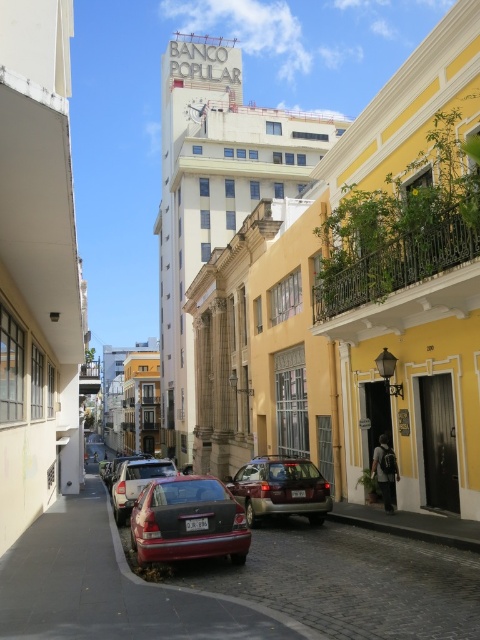
Question: Can you confirm if shiny red sedan at lower center is positioned below matte gray suv at center?

Choices:
 (A) no
 (B) yes

Answer: (A)

Question: Which of the following is the closest to the observer?

Choices:
 (A) (127, 483)
 (B) (295, 493)

Answer: (B)

Question: Which point is farther to the camera?

Choices:
 (A) matte gray suv at center
 (B) matte red car at center

Answer: (B)

Question: Can you confirm if matte gray suv at center is positioned to the left of matte red car at center?

Choices:
 (A) no
 (B) yes

Answer: (A)

Question: Which point appears farthest from the camera in this image?

Choices:
 (A) (190, 504)
 (B) (252, 461)

Answer: (B)

Question: Does shiny red sedan at lower center appear over matte red car at center?

Choices:
 (A) no
 (B) yes

Answer: (B)